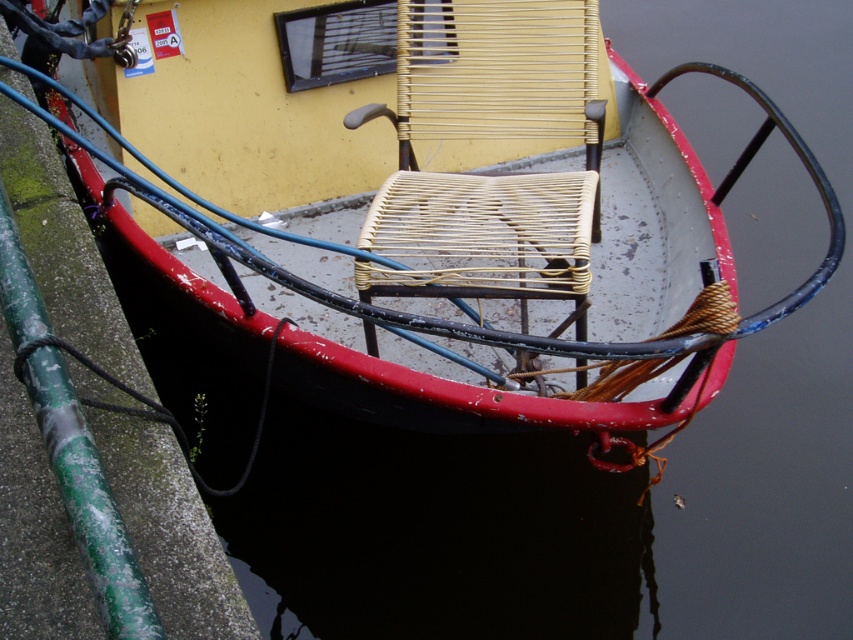
You are standing at the edge of the dock and want to board the rusty metal boat at center. Based on its position, which direction should you walk to reach it?

The rusty metal boat at center is located at point coordinates, so you should walk towards the center of the dock to reach it.

You are standing at the boat and looking towards the dock. Which of the two points, point (584, 339) or point (422, 100), is closer to you?

Point (584, 339) is closer to the viewer than point (422, 100).

You are trying to place a small potted plant between the rusty metal boat at center and the woven wicker chair at center. The plant requires at least 10 inches of space to grow properly. Based on the scene, will there be enough space between them?

The rusty metal boat at center is 7.50 inches away from the woven wicker chair at center. Since the required space for the plant is 10 inches, there isn not enough space between them to accommodate the plant properly.